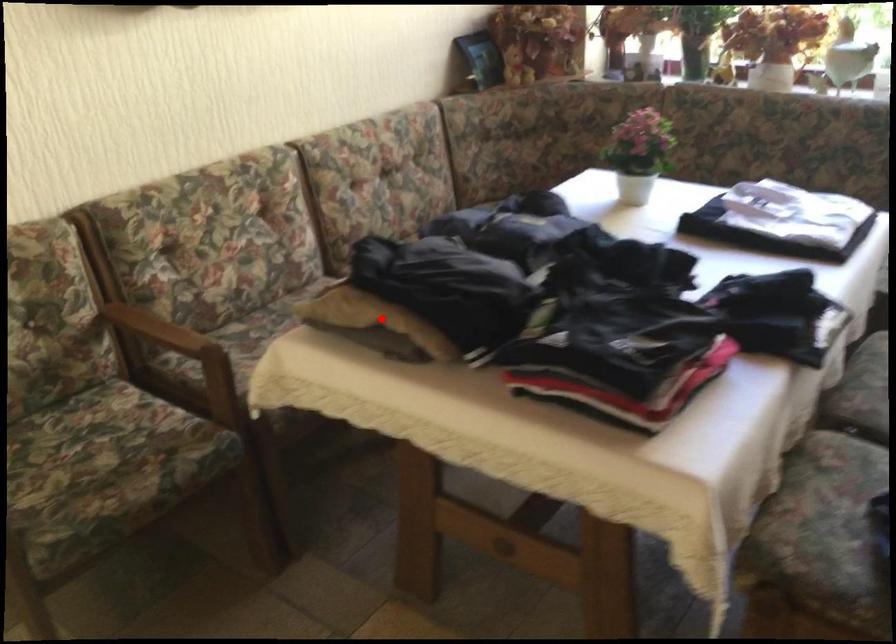
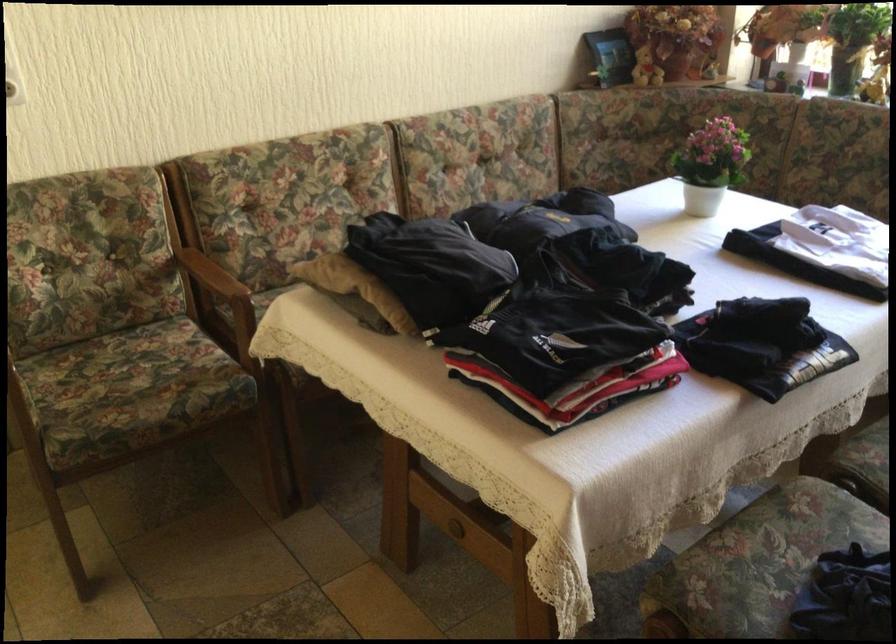
Locate, in the second image, the point that corresponds to the highlighted location in the first image.

(355, 287)